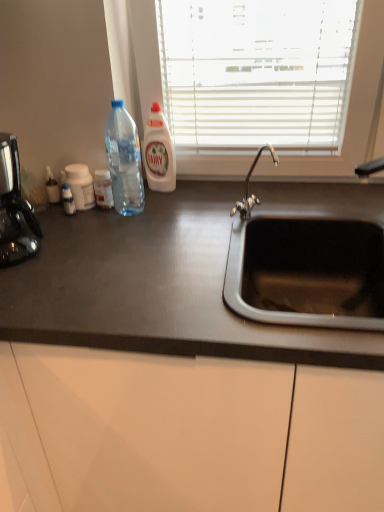
Where is `vacant space to the right of clear plastic bottle at center, which ranks as the second bottle in right-to-left order`? The width and height of the screenshot is (384, 512). vacant space to the right of clear plastic bottle at center, which ranks as the second bottle in right-to-left order is located at coordinates (166, 208).